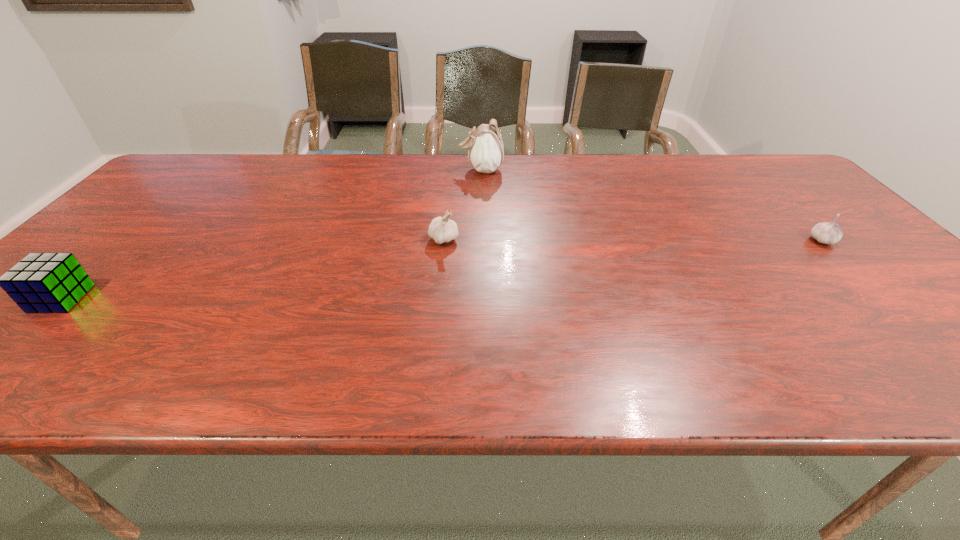
Locate an element on the screen. Image resolution: width=960 pixels, height=540 pixels. pouch is located at coordinates (486, 152).

You are a GUI agent. You are given a task and a screenshot of the screen. Output one action in this format:
    pyautogui.click(x=<x>, y=<y>)
    Task: Click on the tallest object
    The width and height of the screenshot is (960, 540).
    Given the screenshot: What is the action you would take?
    pyautogui.click(x=486, y=152)

In order to click on the left garlic in this screenshot , I will do `click(442, 229)`.

You are a GUI agent. You are given a task and a screenshot of the screen. Output one action in this format:
    pyautogui.click(x=<x>, y=<y>)
    Task: Click on the nearest object
    This screenshot has height=540, width=960.
    Given the screenshot: What is the action you would take?
    pyautogui.click(x=41, y=282)

Locate an element on the screen. This screenshot has height=540, width=960. the leftmost object is located at coordinates click(x=41, y=282).

This screenshot has height=540, width=960. In order to click on the right garlic in this screenshot , I will do `click(830, 233)`.

You are a GUI agent. You are given a task and a screenshot of the screen. Output one action in this format:
    pyautogui.click(x=<x>, y=<y>)
    Task: Click on the rightmost object
    
    Given the screenshot: What is the action you would take?
    pyautogui.click(x=830, y=233)

Identify the location of free space located on the front-facing side of the tallest object. (356, 170).

Locate an element on the screen. This screenshot has width=960, height=540. vacant space located 0.180m on the front-facing side of the tallest object is located at coordinates (402, 170).

This screenshot has height=540, width=960. Identify the location of free spot located on the front-facing side of the tallest object. (348, 170).